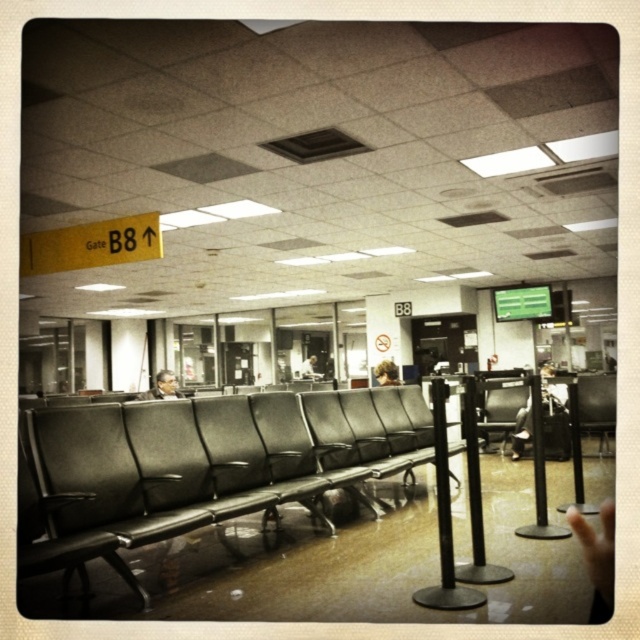
Question: Which point appears farthest from the camera in this image?

Choices:
 (A) (480, 381)
 (B) (60, 428)

Answer: (A)

Question: Does matte black seats at center appear on the right side of matte black chair at center?

Choices:
 (A) no
 (B) yes

Answer: (A)

Question: Does matte black seats at center have a lesser width compared to matte black chair at center?

Choices:
 (A) yes
 (B) no

Answer: (B)

Question: Among these objects, which one is farthest from the camera?

Choices:
 (A) matte black seats at center
 (B) matte black chair at center

Answer: (B)

Question: Is matte black seats at center closer to the viewer compared to matte black chair at center?

Choices:
 (A) yes
 (B) no

Answer: (A)